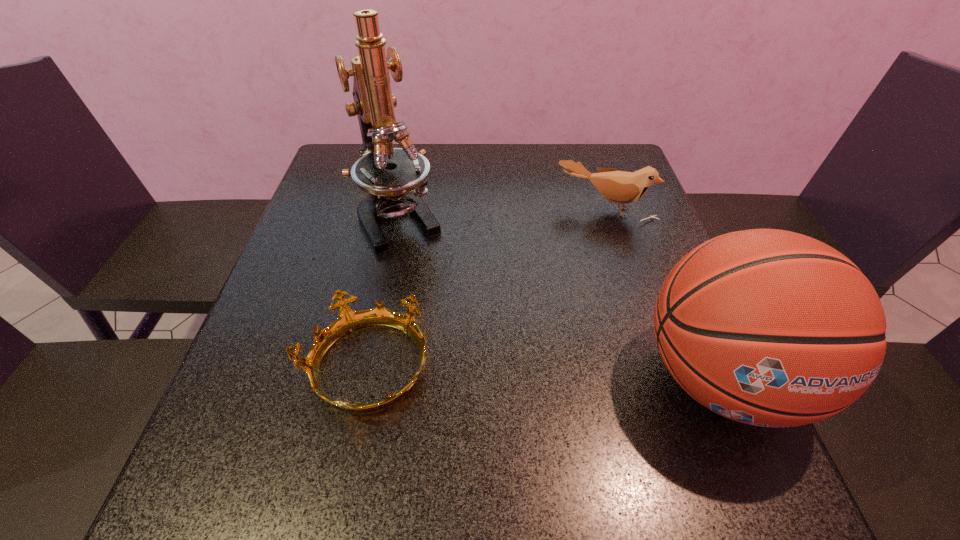
Where is `empty location between the microscope and the bird`? The image size is (960, 540). empty location between the microscope and the bird is located at coordinates (503, 212).

You are a GUI agent. You are given a task and a screenshot of the screen. Output one action in this format:
    pyautogui.click(x=<x>, y=<y>)
    Task: Click on the object that is the second closest to the shortest object
    Image resolution: width=960 pixels, height=540 pixels.
    Given the screenshot: What is the action you would take?
    pyautogui.click(x=767, y=327)

Select which object appears as the second closest to the crown. Please provide its 2D coordinates. Your answer should be formatted as a tuple, i.e. [(x, y)], where the tuple contains the x and y coordinates of a point satisfying the conditions above.

[(767, 327)]